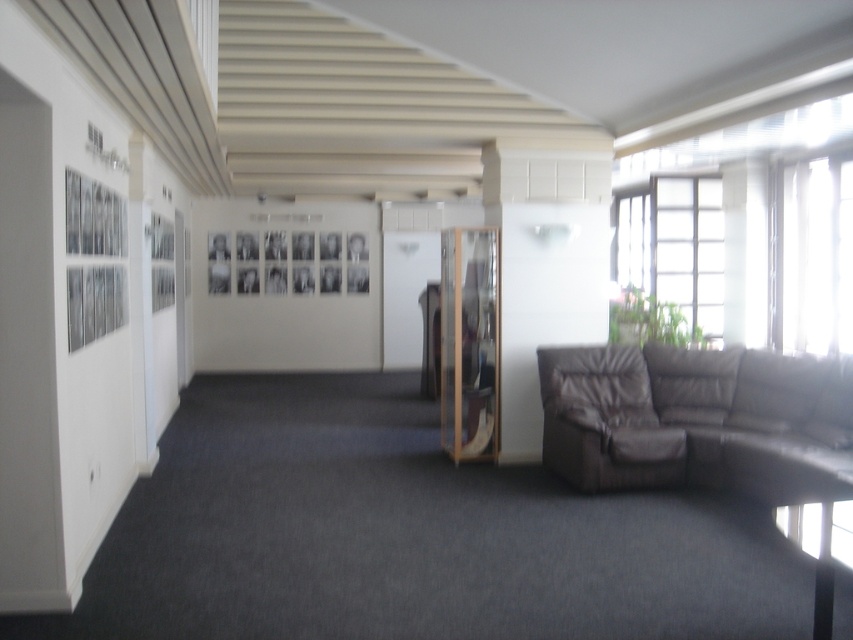
You are sitting on the brown leather armchair at lower right and want to pick up a book from the brown leather couch at lower right. Can you reach it without moving from your seat?

The brown leather couch at lower right is in front of the brown leather armchair at lower right, meaning the couch is closer to you. Since the couch is in front of the armchair, you can likely reach the book without moving from your seat as the couch is within arm

You are standing at the entrance of the room and want to sit on the brown leather couch at lower right. According to the coordinates provided, in which direction should you move from your current position to reach it?

The brown leather couch at lower right is located at coordinates point (698, 420). Since the coordinate system typically places the origin at the bottom left corner, moving towards the right and slightly forward would lead you to the couch.

You are sitting on the brown leather armchair at lower right and want to move to the brown leather couch at lower right. Which direction should you move to reach it?

The brown leather couch at lower right is to the right of the brown leather armchair at lower right, so you should move to your right to reach it.